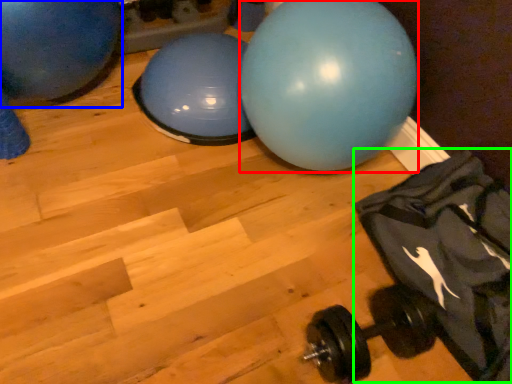
Question: Based on their relative distances, which object is nearer to ball (highlighted by a red box)? Choose from ball (highlighted by a blue box) and bean bag chair (highlighted by a green box).

Choices:
 (A) ball
 (B) bean bag chair

Answer: (B)